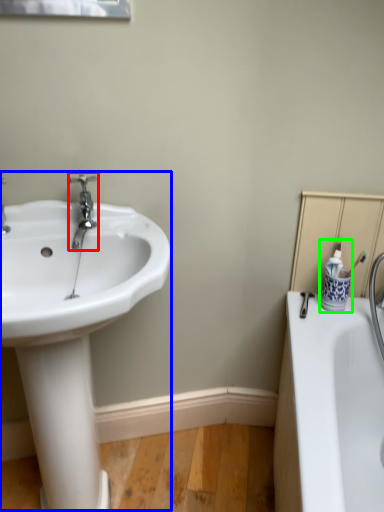
Question: Which is farther away from tap (highlighted by a red box)? sink (highlighted by a blue box) or toiletry (highlighted by a green box)?

Choices:
 (A) sink
 (B) toiletry

Answer: (B)